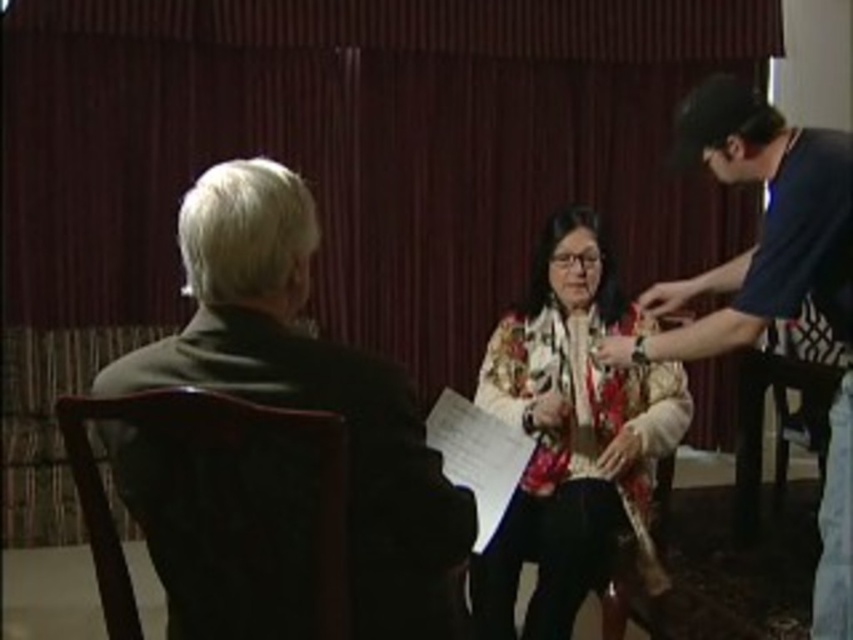
Can you confirm if floral-patterned blouse at center is positioned above wooden chair at lower right?

Yes.

This screenshot has height=640, width=853. What are the coordinates of `floral-patterned blouse at center` in the screenshot? It's located at (570, 432).

The width and height of the screenshot is (853, 640). Find the location of `floral-patterned blouse at center`. floral-patterned blouse at center is located at coordinates (570, 432).

Does blue cotton t-shirt at right have a lesser width compared to wooden chair at lower right?

No, blue cotton t-shirt at right is not thinner than wooden chair at lower right.

Is blue cotton t-shirt at right bigger than wooden chair at lower right?

Yes.

Does point (831, 509) come behind point (838, 378)?

That is False.

Identify the location of blue cotton t-shirt at right. The width and height of the screenshot is (853, 640). [x=772, y=284].

Is point (454, 563) positioned in front of point (578, 506)?

Yes.

Can you confirm if dark brown leather jacket at left is taller than floral-patterned blouse at center?

No.

Is point (318, 364) behind point (682, 394)?

No.

The image size is (853, 640). Identify the location of dark brown leather jacket at left. pos(310,388).